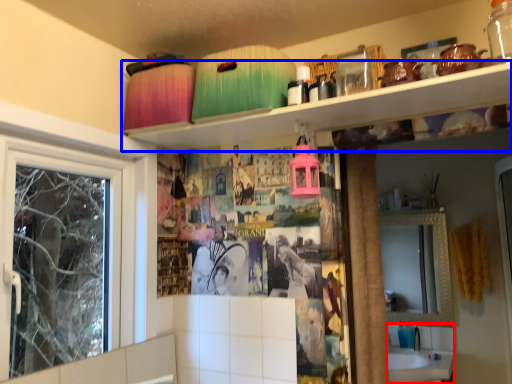
Question: Among these objects, which one is farthest to the camera, sink (highlighted by a red box) or shelf (highlighted by a blue box)?

Choices:
 (A) sink
 (B) shelf

Answer: (A)